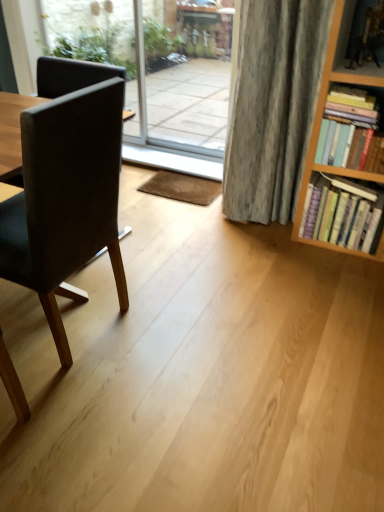
The width and height of the screenshot is (384, 512). Find the location of `free spot in front of matte black chair at left`. free spot in front of matte black chair at left is located at coordinates (77, 418).